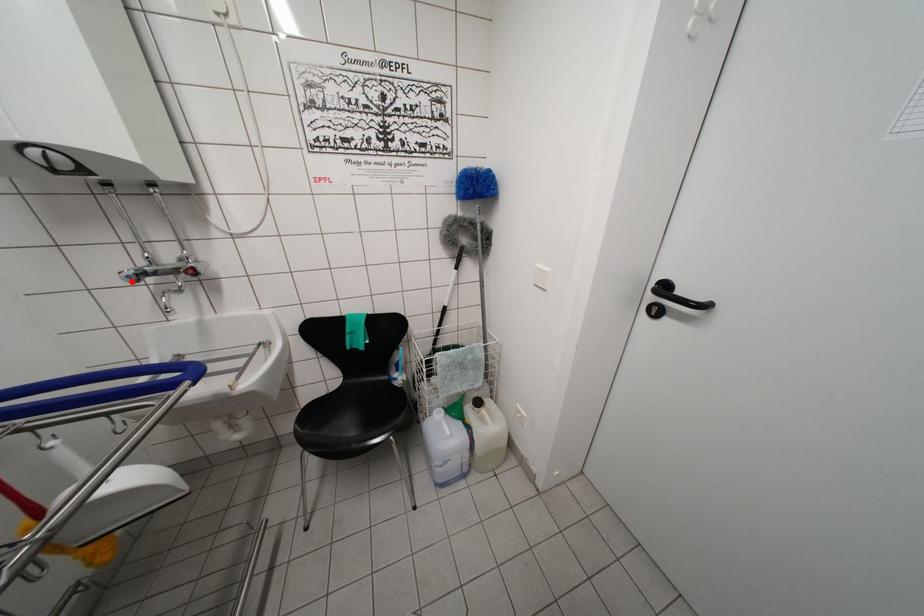
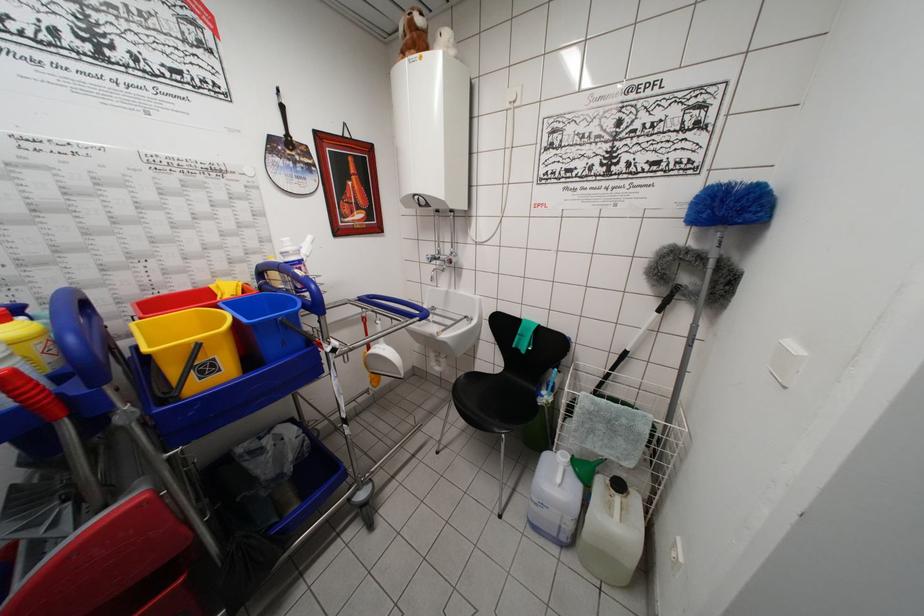
The point at the highlighted location is marked in the first image. Where is the corresponding point in the second image?

(432, 262)